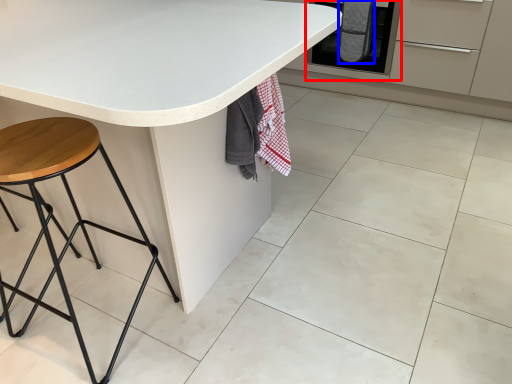
Question: Which point is closer to the camera, oven (highlighted by a red box) or blanket (highlighted by a blue box)?

Choices:
 (A) oven
 (B) blanket

Answer: (A)